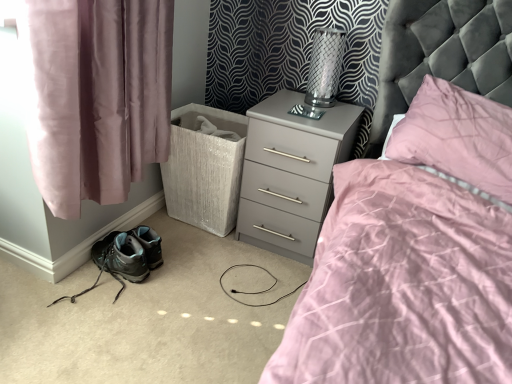
This screenshot has height=384, width=512. Identify the location of free location to the right of metallic mesh table lamp at upper right. (347, 105).